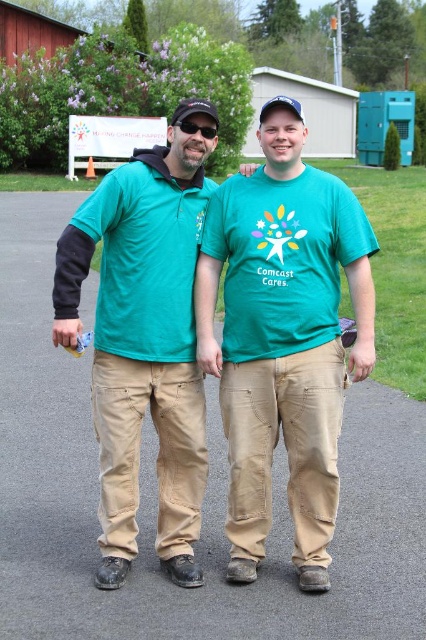
Who is more forward, [123,573] or [203,124]?

Positioned in front is point [123,573].

Is matte green shirt at center to the left of black plastic sunglasses at center from the viewer's perspective?

Correct, you'll find matte green shirt at center to the left of black plastic sunglasses at center.

Measure the distance between matte green shirt at center and camera.

They are 3.63 meters apart.

The image size is (426, 640). I want to click on matte green shirt at center, so click(143, 344).

Which is below, matte khaki pants at center or matte green shirt at center?

matte khaki pants at center is lower down.

Between matte khaki pants at center and matte green shirt at center, which one has more height?

Standing taller between the two is matte khaki pants at center.

Does point (340, 356) come closer to viewer compared to point (104, 188)?

No.

You are a GUI agent. You are given a task and a screenshot of the screen. Output one action in this format:
    pyautogui.click(x=<x>, y=<y>)
    Task: Click on the matte khaki pants at center
    Image resolution: width=426 pixels, height=640 pixels.
    Given the screenshot: What is the action you would take?
    pyautogui.click(x=282, y=337)

Consider the image. Does matte khaki pants at center appear on the left side of black plastic sunglasses at center?

Incorrect, matte khaki pants at center is not on the left side of black plastic sunglasses at center.

Between matte khaki pants at center and black plastic sunglasses at center, which one is positioned lower?

matte khaki pants at center

Does point (258, 291) come in front of point (212, 128)?

That is True.

Locate an element on the screen. Image resolution: width=426 pixels, height=640 pixels. matte khaki pants at center is located at coordinates (282, 337).